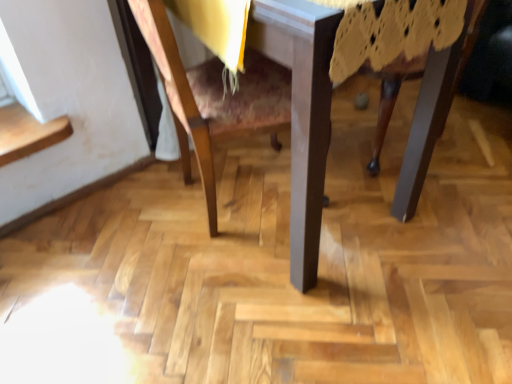
Where is `unoccupied region to the right of wooden table at center`? The width and height of the screenshot is (512, 384). unoccupied region to the right of wooden table at center is located at coordinates [448, 180].